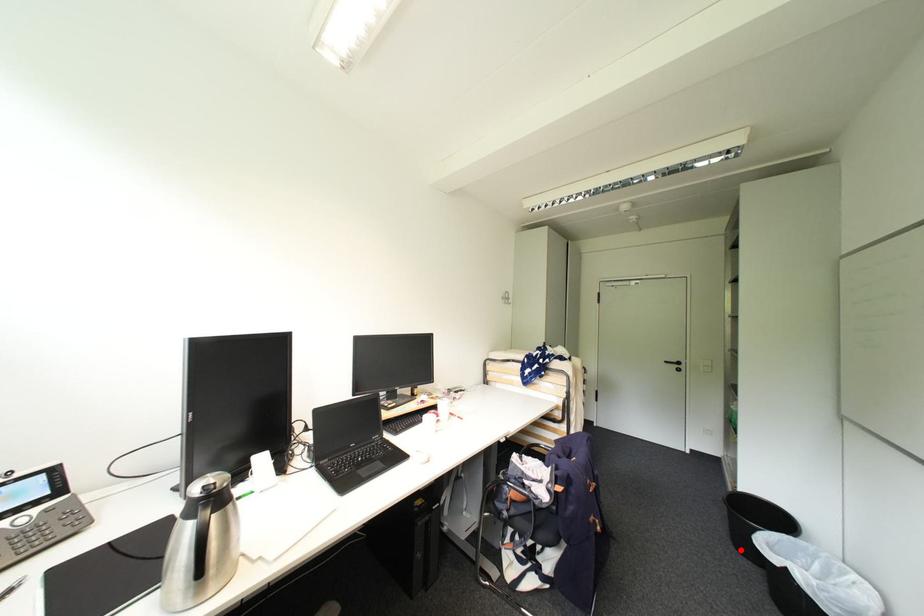
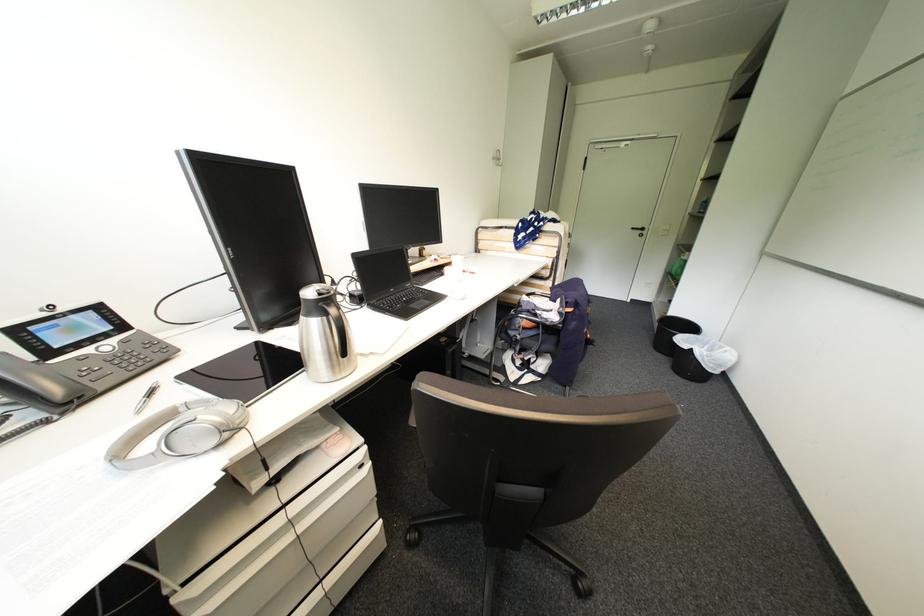
Locate, in the second image, the point that corresponds to the highlighted location in the first image.

(660, 351)